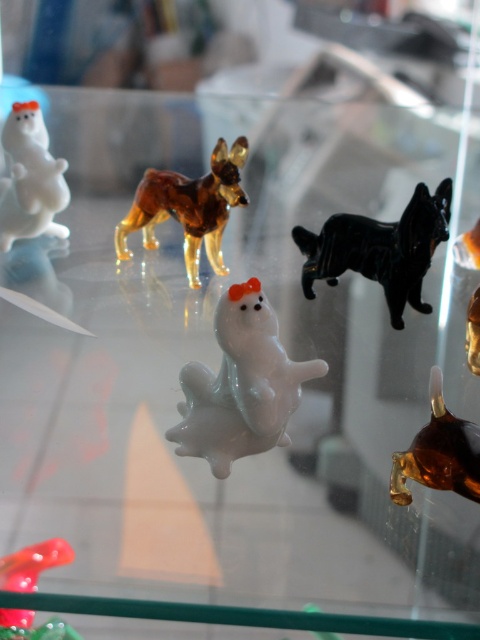
Does black glossy dog at center appear on the right side of white glossy bear at upper left?

Yes, black glossy dog at center is to the right of white glossy bear at upper left.

The height and width of the screenshot is (640, 480). What do you see at coordinates (381, 248) in the screenshot?
I see `black glossy dog at center` at bounding box center [381, 248].

The height and width of the screenshot is (640, 480). Identify the location of black glossy dog at center. (381, 248).

In the scene shown: Which of these two, black glossy dog at center or amber glass dog at upper center, stands taller?

amber glass dog at upper center

What do you see at coordinates (381, 248) in the screenshot? The image size is (480, 640). I see `black glossy dog at center` at bounding box center [381, 248].

Find the location of `black glossy dog at center`. black glossy dog at center is located at coordinates (381, 248).

Which is in front, point (213, 384) or point (41, 628)?

Positioned in front is point (41, 628).

Is white glossy dog at center to the right of translucent red figurine at lower left from the viewer's perspective?

Yes, white glossy dog at center is to the right of translucent red figurine at lower left.

Does point (310, 360) come closer to viewer compared to point (8, 563)?

No, it is behind (8, 563).

Find the location of `white glossy dog at center`. white glossy dog at center is located at coordinates (240, 385).